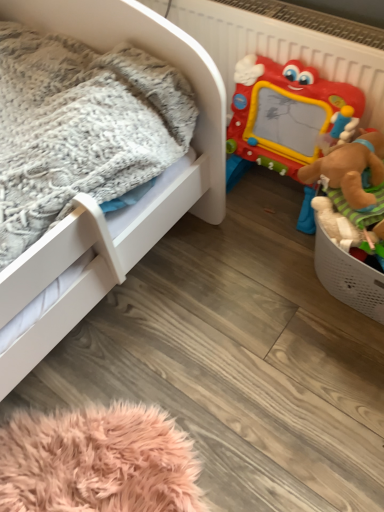
Locate an element on the screen. This screenshot has width=384, height=512. vacant area that lies in front of plastic drawing board at right is located at coordinates (258, 290).